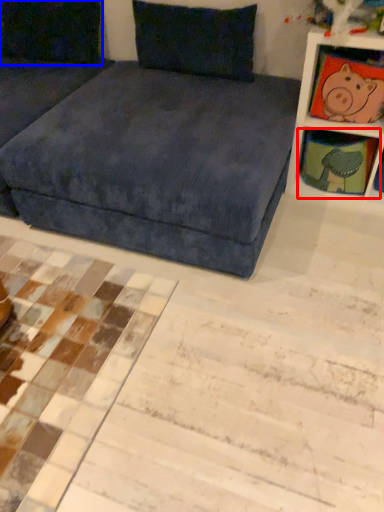
Question: Which object is closer to the camera taking this photo, shelf (highlighted by a red box) or pillow (highlighted by a blue box)?

Choices:
 (A) shelf
 (B) pillow

Answer: (A)